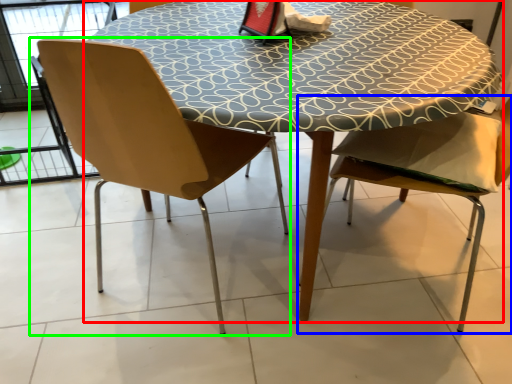
Question: Which is farther away from table (highlighted by a red box)? chair (highlighted by a blue box) or chair (highlighted by a green box)?

Choices:
 (A) chair
 (B) chair

Answer: (A)